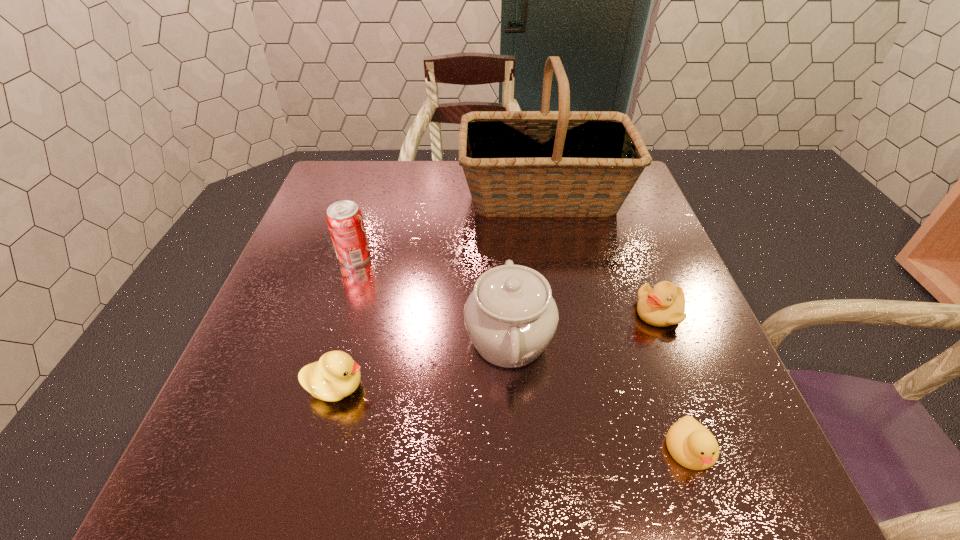
The width and height of the screenshot is (960, 540). I want to click on soda can that is positioned at the left edge, so click(345, 221).

The width and height of the screenshot is (960, 540). I want to click on duckling located at the left edge, so click(x=335, y=376).

You are a GUI agent. You are given a task and a screenshot of the screen. Output one action in this format:
    pyautogui.click(x=<x>, y=<y>)
    Task: Click on the basket situated at the right edge
    This screenshot has height=540, width=960.
    Given the screenshot: What is the action you would take?
    (x=563, y=163)

Locate an element on the screen. Image resolution: width=960 pixels, height=540 pixels. object located in the far right corner section of the desktop is located at coordinates (563, 163).

This screenshot has width=960, height=540. In order to click on object situated at the near right corner in this screenshot , I will do (x=692, y=445).

Locate an element on the screen. vacant area at the far edge is located at coordinates (409, 194).

In the image, there is a desktop. Where is `vacant space at the left edge`? This screenshot has width=960, height=540. vacant space at the left edge is located at coordinates (299, 252).

This screenshot has width=960, height=540. I want to click on free space at the right edge of the desktop, so click(x=615, y=228).

This screenshot has width=960, height=540. I want to click on vacant space at the far left corner of the desktop, so click(358, 194).

The height and width of the screenshot is (540, 960). In order to click on blank region between the chinaware and the shortest object in this screenshot , I will do `click(600, 394)`.